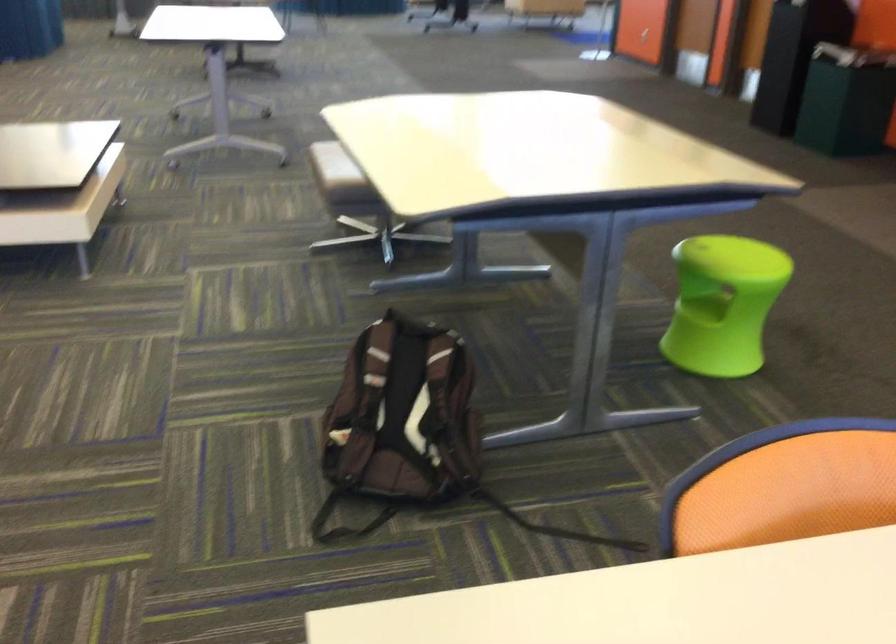
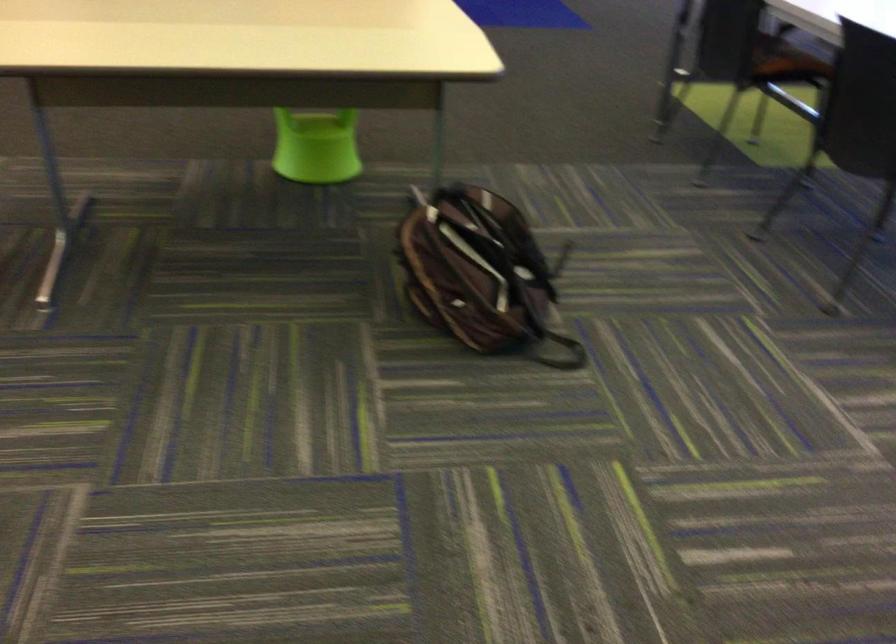
The point at (419, 527) is marked in the first image. Where is the corresponding point in the second image?

(552, 322)